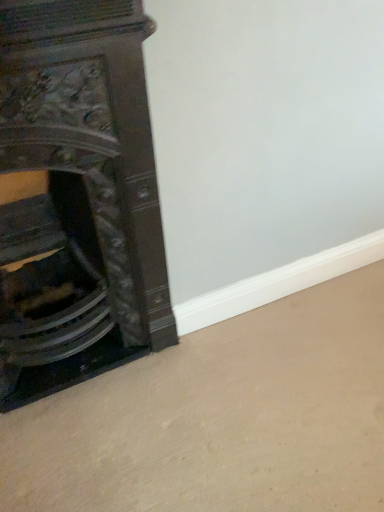
You are a GUI agent. You are given a task and a screenshot of the screen. Output one action in this format:
    pyautogui.click(x=<x>, y=<y>)
    Task: Click on the dark wood fireplace at left
    This screenshot has height=512, width=384.
    Given the screenshot: What is the action you would take?
    pyautogui.click(x=76, y=197)

Measure the distance between point (102, 320) and camera.

The depth of point (102, 320) is 3.81 feet.

This screenshot has width=384, height=512. What do you see at coordinates (76, 197) in the screenshot? I see `dark wood fireplace at left` at bounding box center [76, 197].

What are the coordinates of `dark wood fireplace at left` in the screenshot? It's located at (76, 197).